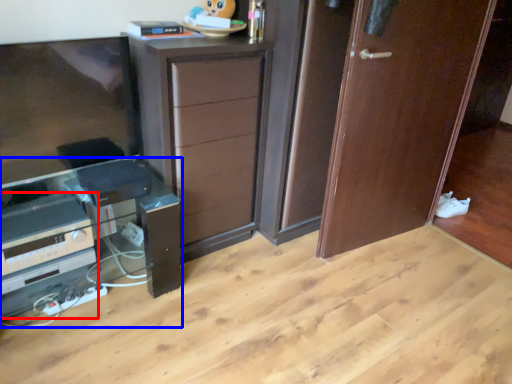
Question: Which object is further to the camera taking this photo, appliance (highlighted by a red box) or computer desk (highlighted by a blue box)?

Choices:
 (A) appliance
 (B) computer desk

Answer: (A)